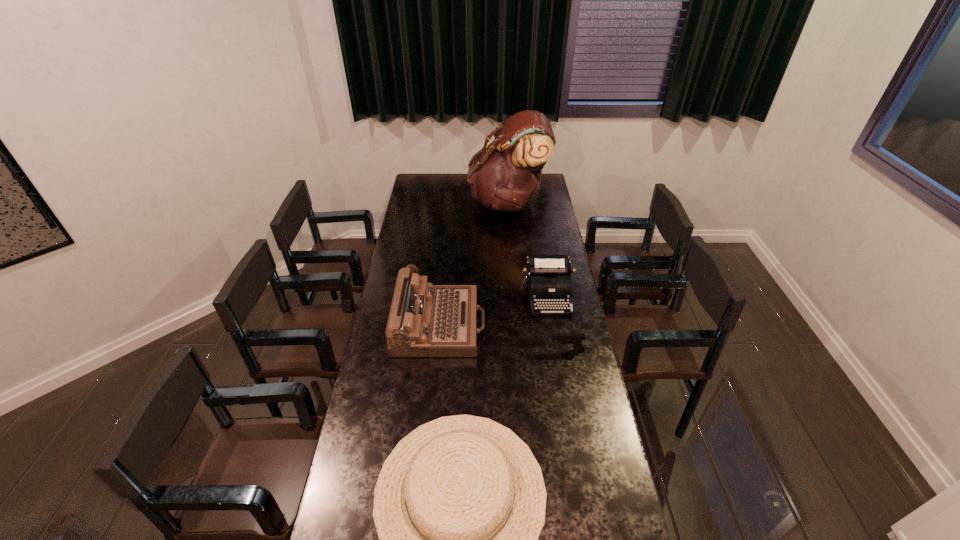
Where is `blank area located 0.380m on the keyboard of the fourth shortest object`? The width and height of the screenshot is (960, 540). blank area located 0.380m on the keyboard of the fourth shortest object is located at coordinates (572, 325).

Locate an element on the screen. This screenshot has height=540, width=960. vacant space situated on the typing side of the shorter typewriter is located at coordinates (552, 329).

Locate an element on the screen. vacant space located on the front-facing side of the pistol is located at coordinates (504, 350).

Where is `vacant area situated 0.370m on the front-facing side of the pistol`? This screenshot has height=540, width=960. vacant area situated 0.370m on the front-facing side of the pistol is located at coordinates (458, 350).

I want to click on vacant space located on the front-facing side of the pistol, so click(x=466, y=350).

Find the location of a particular element. This screenshot has height=540, width=960. object at the far edge is located at coordinates (504, 176).

Where is `object that is at the left edge`? The height and width of the screenshot is (540, 960). object that is at the left edge is located at coordinates (425, 320).

The width and height of the screenshot is (960, 540). I want to click on satchel that is at the right edge, so click(x=504, y=176).

At what (x,y) coordinates should I click in order to perform the action: click on typewriter that is at the right edge. Please return your answer as a coordinate pair (x, y). This screenshot has width=960, height=540. Looking at the image, I should click on (549, 282).

Identify the location of pistol that is at the right edge. (576, 339).